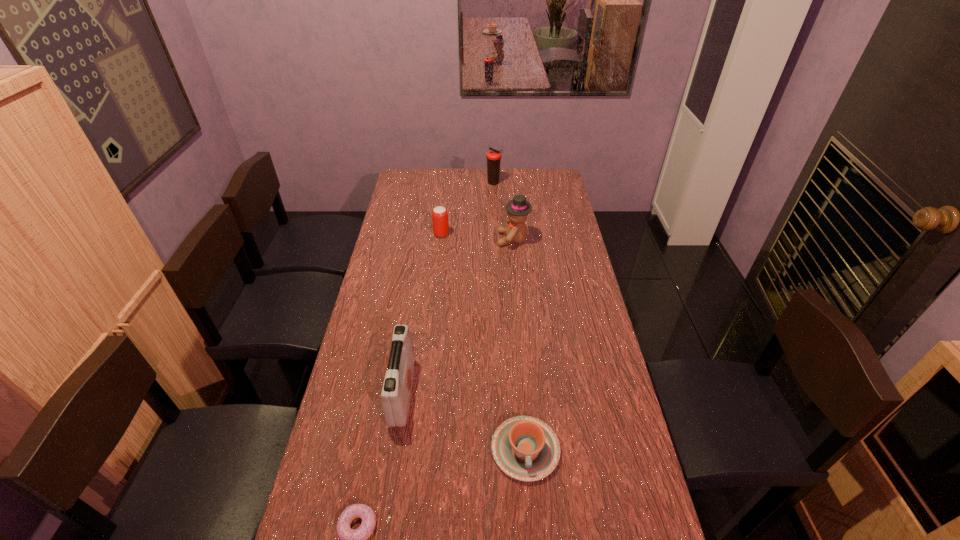
Locate an element on the screen. vacant space located on the front side of the first-aid kit is located at coordinates (455, 393).

The width and height of the screenshot is (960, 540). Identify the location of vacant space positioned 0.120m on the front of the fourth tallest object. (439, 256).

This screenshot has width=960, height=540. In order to click on vacant space located on the handle side of the chinaware in this screenshot , I will do point(531,522).

Locate an element on the screen. This screenshot has height=540, width=960. object that is at the far edge is located at coordinates (493, 157).

Find the location of `object that is at the left edge`. object that is at the left edge is located at coordinates (396, 393).

Find the location of `free spot at the left edge of the desktop`. free spot at the left edge of the desktop is located at coordinates (374, 324).

Where is `vacant space at the right edge of the desktop`? vacant space at the right edge of the desktop is located at coordinates (547, 199).

Where is `free space at the far left corner of the desktop`? The height and width of the screenshot is (540, 960). free space at the far left corner of the desktop is located at coordinates (423, 191).

Locate an element on the screen. vacant area that lies between the chinaware and the rag_doll is located at coordinates (519, 345).

This screenshot has height=540, width=960. I want to click on vacant space in between the chinaware and the thermos bottle, so click(x=510, y=316).